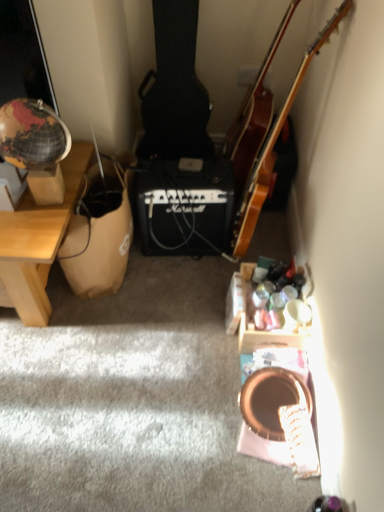
Locate an element on the screen. The image size is (384, 512). free space in front of wooden desk at left is located at coordinates (67, 382).